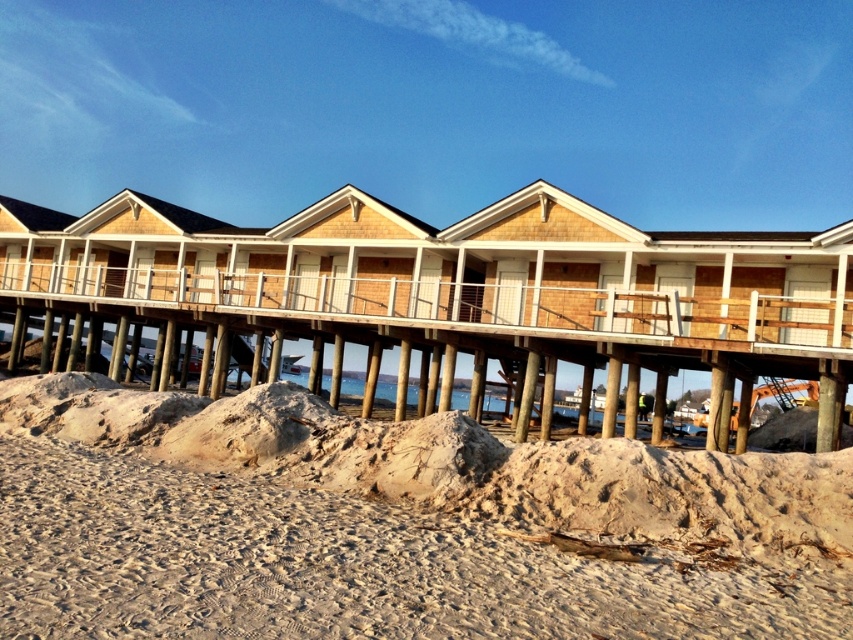
Question: Does fine sand at lower center have a greater width compared to wooden dock at center?

Choices:
 (A) yes
 (B) no

Answer: (B)

Question: Can you confirm if fine sand at lower center is wider than wooden dock at center?

Choices:
 (A) yes
 (B) no

Answer: (B)

Question: Which point appears closest to the camera in this image?

Choices:
 (A) (169, 276)
 (B) (433, 417)

Answer: (B)

Question: Which of the following is the farthest from the observer?

Choices:
 (A) fine sand at lower center
 (B) wooden dock at center

Answer: (B)

Question: Is fine sand at lower center wider than wooden dock at center?

Choices:
 (A) no
 (B) yes

Answer: (A)